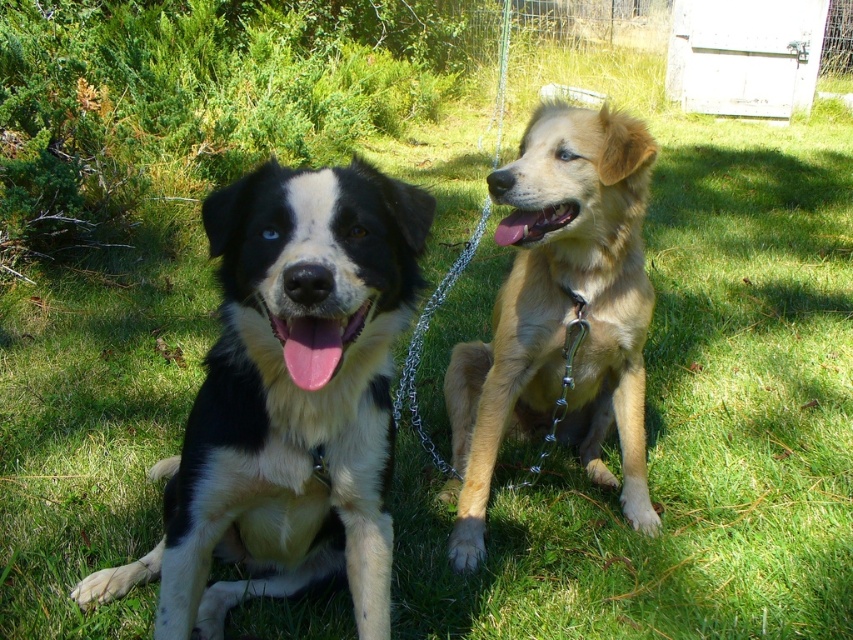
Question: Is black and white fur dog at left wider than golden fur dog at right?

Choices:
 (A) yes
 (B) no

Answer: (A)

Question: Does black and white fur dog at left appear on the right side of golden fur dog at right?

Choices:
 (A) no
 (B) yes

Answer: (A)

Question: Which object is farther from the camera taking this photo?

Choices:
 (A) black and white fur dog at left
 (B) golden fur dog at right

Answer: (B)

Question: Which of the following is the closest to the observer?

Choices:
 (A) black and white fur dog at left
 (B) golden fur dog at right

Answer: (A)

Question: Is black and white fur dog at left above golden fur dog at right?

Choices:
 (A) yes
 (B) no

Answer: (B)